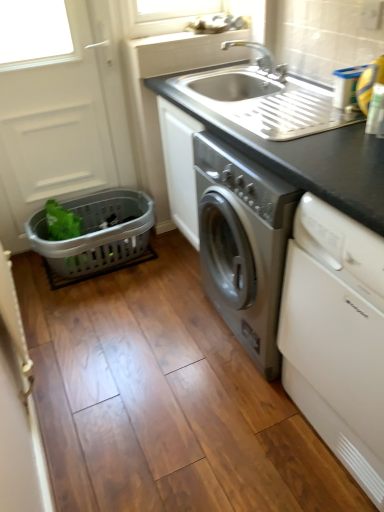
Question: From a real-world perspective, is white matte screen door at left positioned under gray plastic basket at lower left based on gravity?

Choices:
 (A) yes
 (B) no

Answer: (B)

Question: Could you tell me if white matte screen door at left is facing gray plastic basket at lower left?

Choices:
 (A) yes
 (B) no

Answer: (A)

Question: Can you confirm if white matte screen door at left is positioned to the left of gray plastic basket at lower left?

Choices:
 (A) yes
 (B) no

Answer: (A)

Question: Is white matte screen door at left positioned beyond the bounds of gray plastic basket at lower left?

Choices:
 (A) no
 (B) yes

Answer: (B)

Question: Does white matte screen door at left have a lesser width compared to gray plastic basket at lower left?

Choices:
 (A) no
 (B) yes

Answer: (B)

Question: From the image's perspective, would you say white matte screen door at left is positioned over gray plastic basket at lower left?

Choices:
 (A) no
 (B) yes

Answer: (B)

Question: Is green plastic basket at left thinner than silver metallic faucet at upper center?

Choices:
 (A) no
 (B) yes

Answer: (B)

Question: From the image's perspective, is green plastic basket at left on silver metallic faucet at upper center?

Choices:
 (A) no
 (B) yes

Answer: (A)

Question: Is green plastic basket at left oriented away from silver metallic faucet at upper center?

Choices:
 (A) yes
 (B) no

Answer: (B)

Question: Can you confirm if green plastic basket at left is bigger than silver metallic faucet at upper center?

Choices:
 (A) no
 (B) yes

Answer: (B)

Question: From a real-world perspective, is green plastic basket at left located higher than silver metallic faucet at upper center?

Choices:
 (A) no
 (B) yes

Answer: (A)

Question: Can you confirm if green plastic basket at left is shorter than silver metallic faucet at upper center?

Choices:
 (A) yes
 (B) no

Answer: (B)

Question: Is the position of white glossy dishwasher at lower right less distant than that of green plastic basket at left?

Choices:
 (A) no
 (B) yes

Answer: (B)